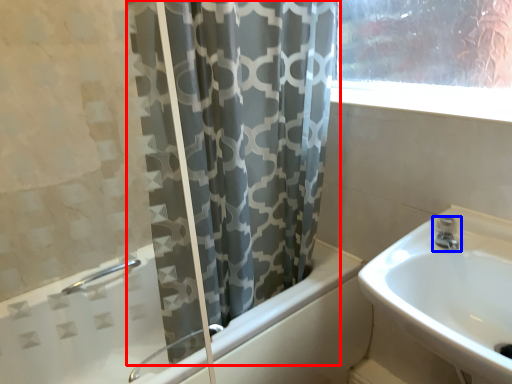
Question: Which object appears closest to the camera in this image, curtain (highlighted by a red box) or tap (highlighted by a blue box)?

Choices:
 (A) curtain
 (B) tap

Answer: (A)